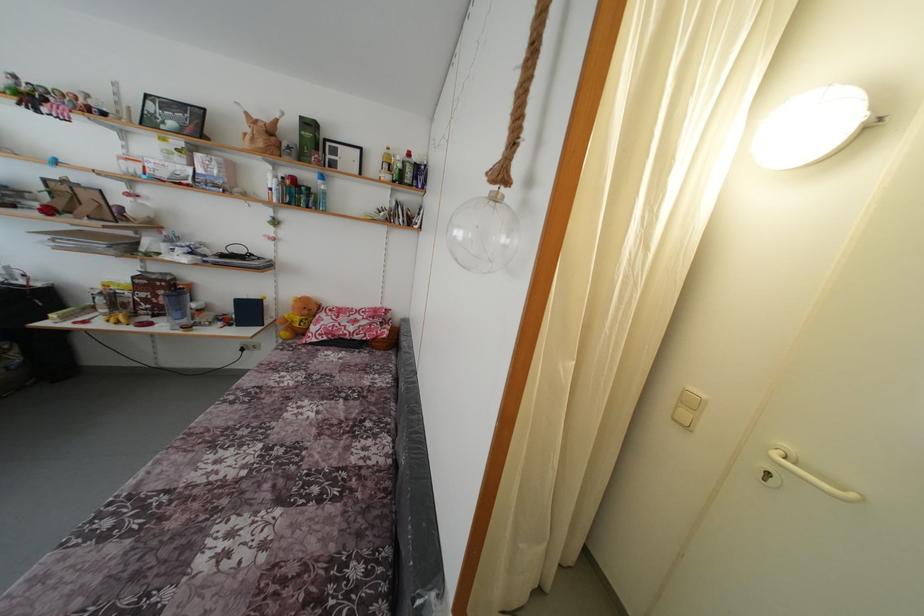
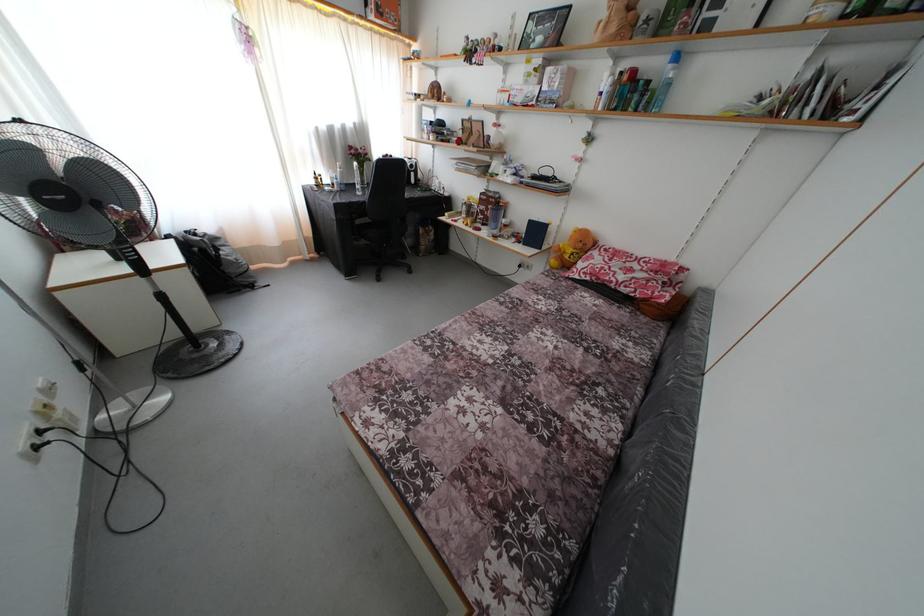
Find the pixel in the second image that matches (x=248, y=355) in the first image.

(525, 272)